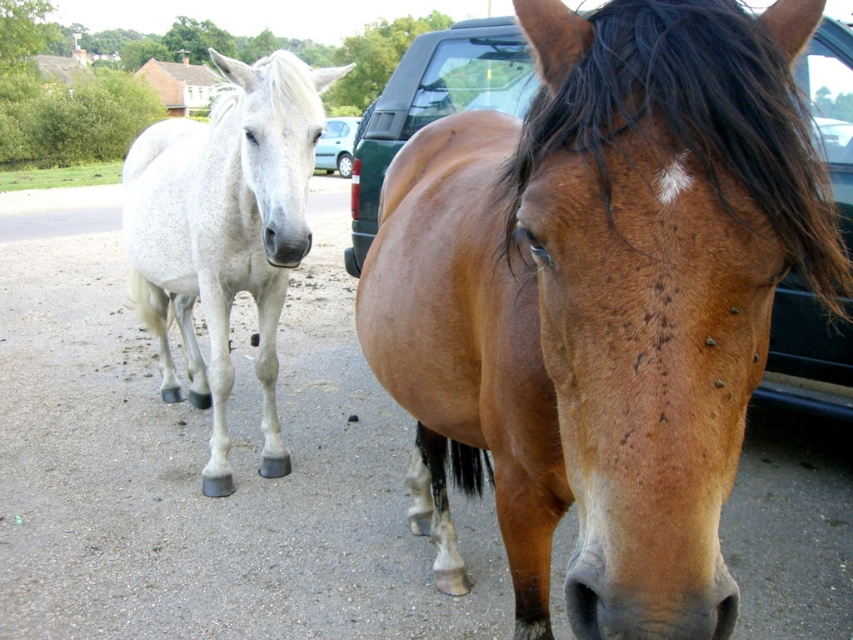
Is brown silky mane at center below white glossy horse at left?

Yes, brown silky mane at center is below white glossy horse at left.

You are a GUI agent. You are given a task and a screenshot of the screen. Output one action in this format:
    pyautogui.click(x=<x>, y=<y>)
    Task: Click on the brown silky mane at center
    
    Given the screenshot: What is the action you would take?
    pyautogui.click(x=688, y=113)

Image resolution: width=853 pixels, height=640 pixels. Find the location of `brown silky mane at center`. brown silky mane at center is located at coordinates (688, 113).

Identify the location of brown silky mane at center. This screenshot has height=640, width=853. (688, 113).

From the picture: Is brown silky mane at center to the right of metallic silver car at center from the viewer's perspective?

Yes, brown silky mane at center is to the right of metallic silver car at center.

Identify the location of brown silky mane at center. The height and width of the screenshot is (640, 853). (688, 113).

In the scene shown: Is brown shiny horse at center positioned at the back of metallic silver car at center?

No, it is in front of metallic silver car at center.

Does brown shiny horse at center appear on the left side of metallic silver car at center?

No, brown shiny horse at center is not to the left of metallic silver car at center.

Identify the location of brown shiny horse at center. (x=602, y=300).